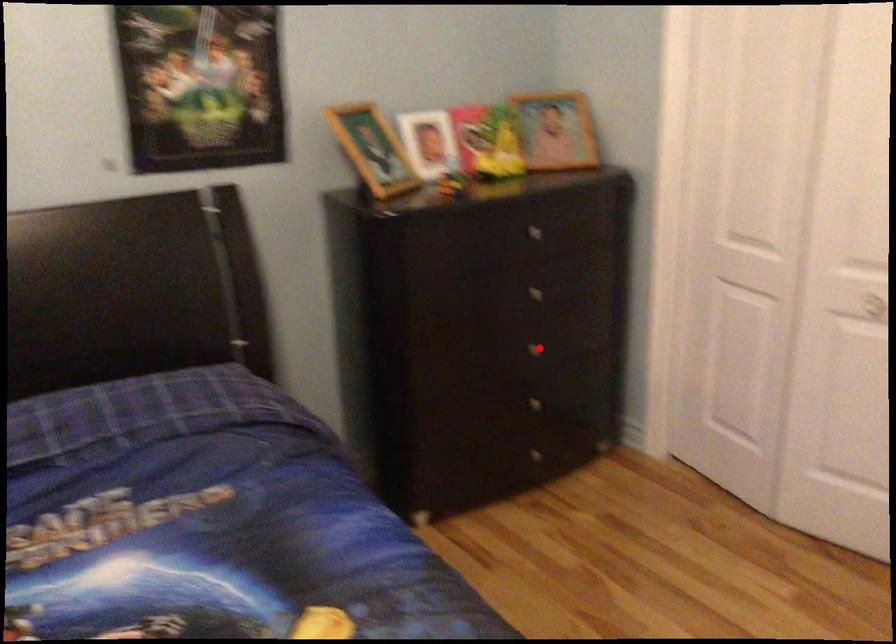
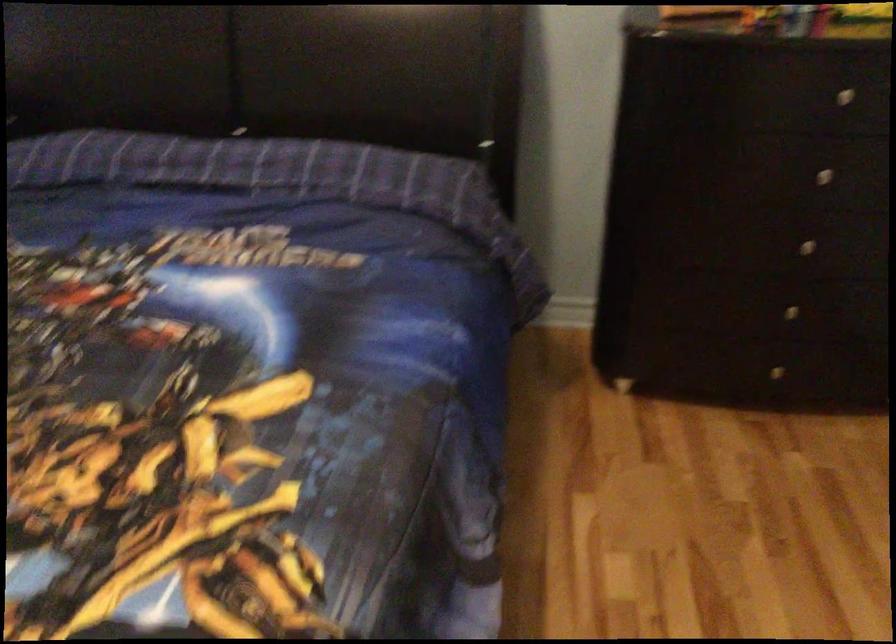
Question: I am providing you with two images of the same scene from different viewpoints. In image1, a red point is highlighted. Considering the same 3D point in image2, which of the following is correct?

Choices:
 (A) It is closer
 (B) It is farther

Answer: (A)